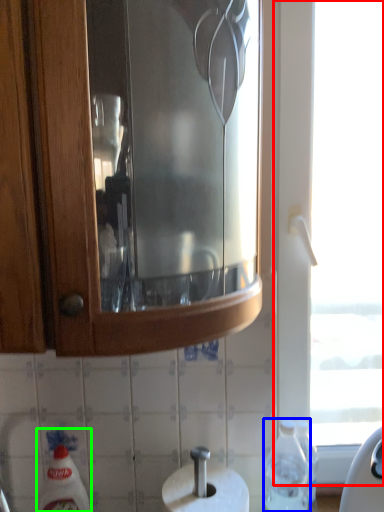
Question: Which object is positioned closest to window (highlighted by a red box)? Select from bottle (highlighted by a blue box) and cleaning product (highlighted by a green box).

Choices:
 (A) bottle
 (B) cleaning product

Answer: (A)